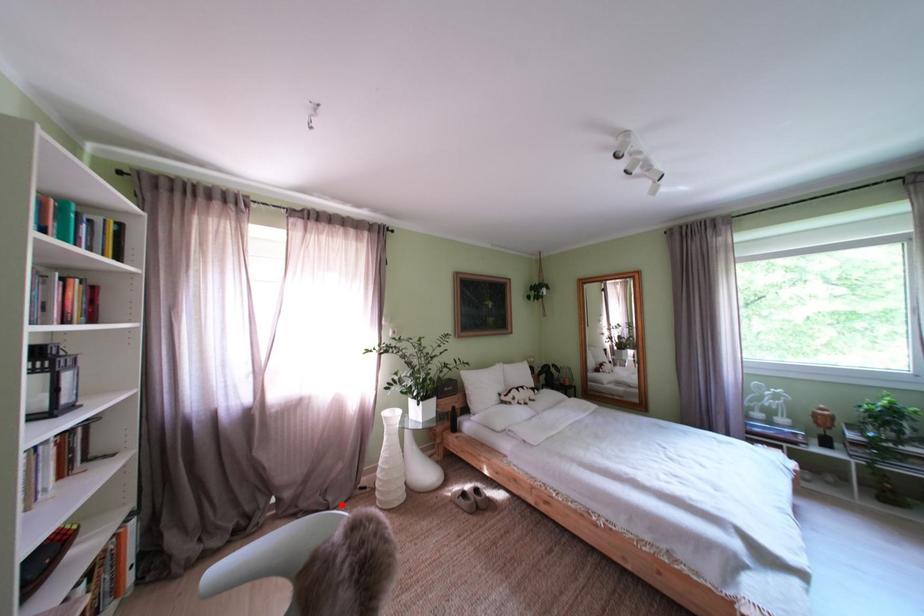
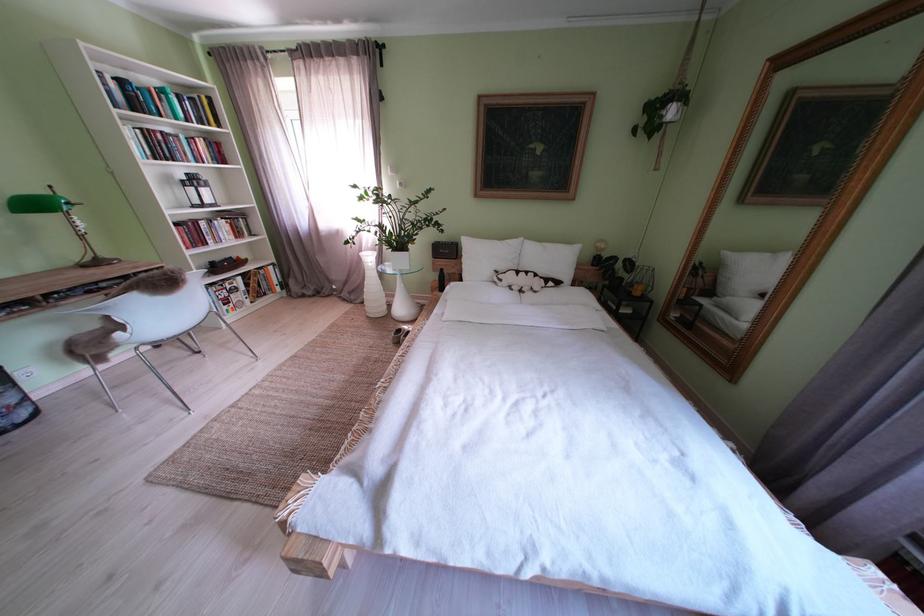
Question: I am providing you with two images of the same scene from different viewpoints. Image1 has a red point marked. In image2, the corresponding 3D location appears at what relative position? Reply with the corresponding letter.

Choices:
 (A) Closer
 (B) Farther

Answer: (B)